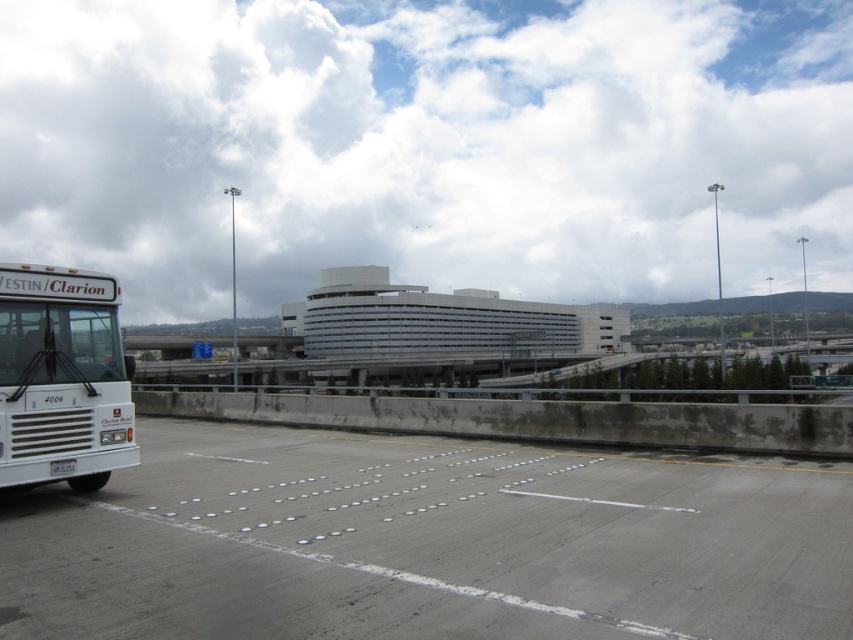
Question: Which point is closer to the camera?

Choices:
 (A) gray concrete highway at center
 (B) white matte bus at left

Answer: (A)

Question: Can you confirm if gray concrete highway at center is positioned to the left of white matte bus at left?

Choices:
 (A) yes
 (B) no

Answer: (B)

Question: Which of the following is the closest to the observer?

Choices:
 (A) coord(367,564)
 (B) coord(4,332)

Answer: (A)

Question: Is gray concrete highway at center positioned in front of white matte bus at left?

Choices:
 (A) no
 (B) yes

Answer: (B)

Question: Is gray concrete highway at center to the left of white matte bus at left from the viewer's perspective?

Choices:
 (A) no
 (B) yes

Answer: (A)